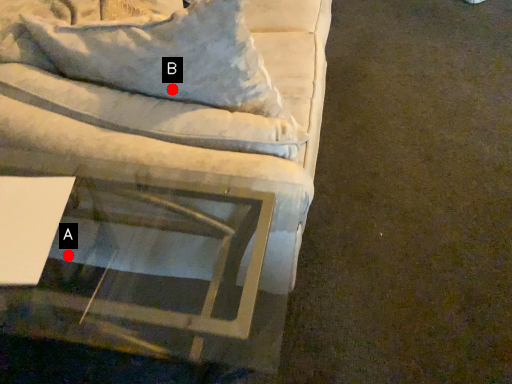
Question: Two points are circled on the image, labeled by A and B beside each circle. Which point is farther to the camera?

Choices:
 (A) A is further
 (B) B is further

Answer: (A)